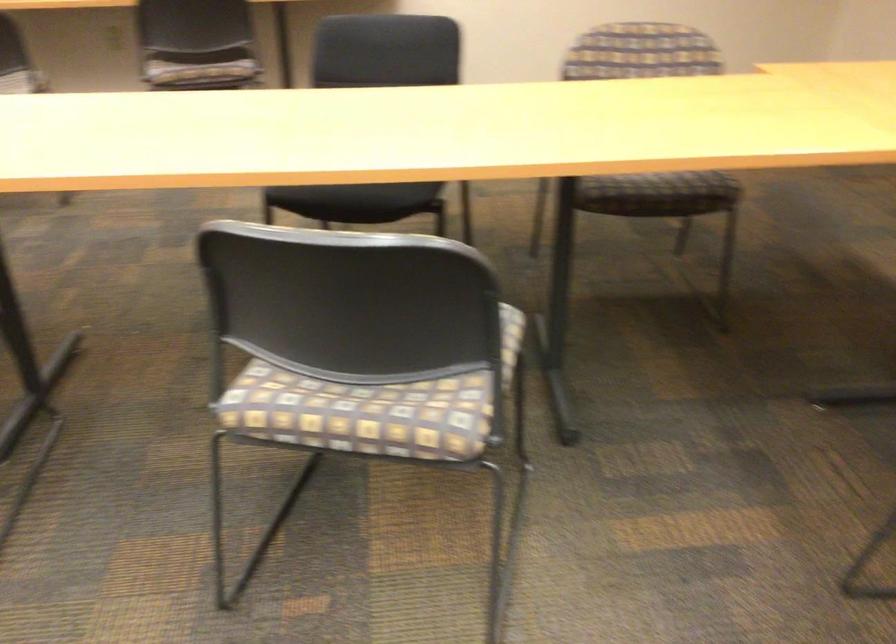
Locate an element on the screen. Image resolution: width=896 pixels, height=644 pixels. cushioned chair sitting surface is located at coordinates (657, 194).